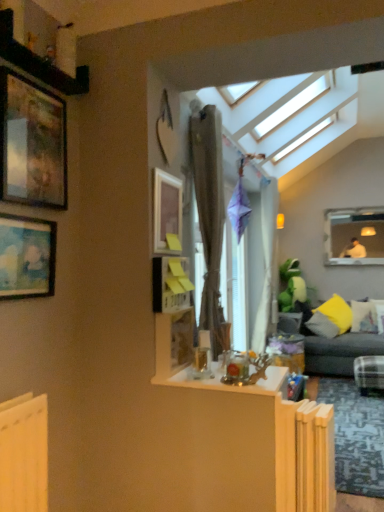
Question: Is yellow fabric pillow at right, which appears as the 1th pillow when viewed from the left, wider than clear glass table at center?

Choices:
 (A) no
 (B) yes

Answer: (A)

Question: Is yellow fabric pillow at right, which is counted as the 3th pillow, starting from the right, in front of clear glass table at center?

Choices:
 (A) yes
 (B) no

Answer: (B)

Question: Considering the relative sizes of yellow fabric pillow at right, which appears as the 1th pillow when viewed from the left, and clear glass table at center in the image provided, is yellow fabric pillow at right, which appears as the 1th pillow when viewed from the left, bigger than clear glass table at center?

Choices:
 (A) yes
 (B) no

Answer: (A)

Question: Does yellow fabric pillow at right, which is counted as the 3th pillow, starting from the right, touch clear glass table at center?

Choices:
 (A) no
 (B) yes

Answer: (A)

Question: Are yellow fabric pillow at right, which is counted as the 3th pillow, starting from the right, and clear glass table at center far apart?

Choices:
 (A) no
 (B) yes

Answer: (B)

Question: Is yellow fabric pillow at right, which is counted as the 3th pillow, starting from the right, located outside clear glass table at center?

Choices:
 (A) yes
 (B) no

Answer: (A)

Question: Is brown textured curtain at center positioned beyond the bounds of matte white frame at upper right, which ranks as the 2th window frame in front-to-back order?

Choices:
 (A) no
 (B) yes

Answer: (B)

Question: From a real-world perspective, is brown textured curtain at center physically below matte white frame at upper right, acting as the 2th window frame starting from the left?

Choices:
 (A) yes
 (B) no

Answer: (A)

Question: Is brown textured curtain at center in front of matte white frame at upper right, acting as the 2th window frame starting from the left?

Choices:
 (A) yes
 (B) no

Answer: (A)

Question: Can you confirm if brown textured curtain at center is wider than matte white frame at upper right, acting as the 2th window frame starting from the left?

Choices:
 (A) no
 (B) yes

Answer: (B)

Question: Is matte white frame at upper right, which ranks as the first window frame in right-to-left order, completely or partially inside brown textured curtain at center?

Choices:
 (A) no
 (B) yes

Answer: (A)

Question: Is brown textured curtain at center to the left of matte white frame at upper right, which ranks as the first window frame in right-to-left order, from the viewer's perspective?

Choices:
 (A) yes
 (B) no

Answer: (A)

Question: From a real-world perspective, is dark gray fabric couch at right physically below matte white frame at upper right, acting as the 2th window frame starting from the left?

Choices:
 (A) yes
 (B) no

Answer: (A)